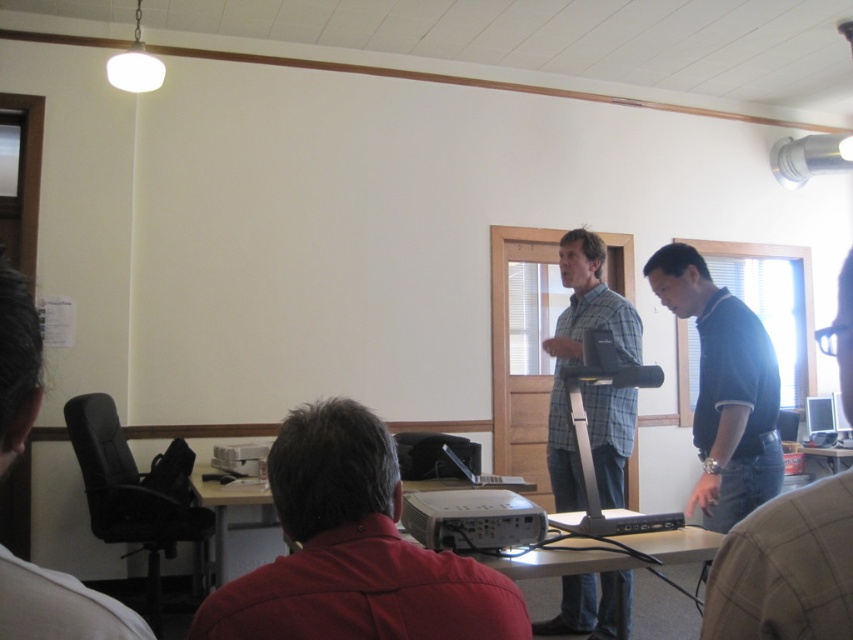
You are a presenter standing in the middle of the room. You need to walk to the blue polo shirt at right and the black leather chair at left to interact with them. Which one can you reach first if you start moving towards both at the same time?

The blue polo shirt at right and black leather chair at left are 24.83 inches apart. Since you are starting from the middle, you can reach both at the same time because the distance to each is the same.

You are setting up a conference room and need to place the white plastic projector at center and the silver metallic monitor at center on a shelf. The shelf has a maximum width capacity of 50 cm. According to the description, can both items fit side by side on the shelf?

The white plastic projector at center might be wider than the silver metallic monitor at center. Since their combined widths could exceed the shelf capacity, it is uncertain if they will fit without knowing the exact dimensions.

You are setting up a presentation in the conference room. You need to adjust the white plastic projector at center and the silver metallic monitor at center so that the projector is no longer above the monitor. How should you move them?

Move the white plastic projector at center downward or move the silver metallic monitor at center upward so that the white plastic projector at center is no longer above the silver metallic monitor at center.